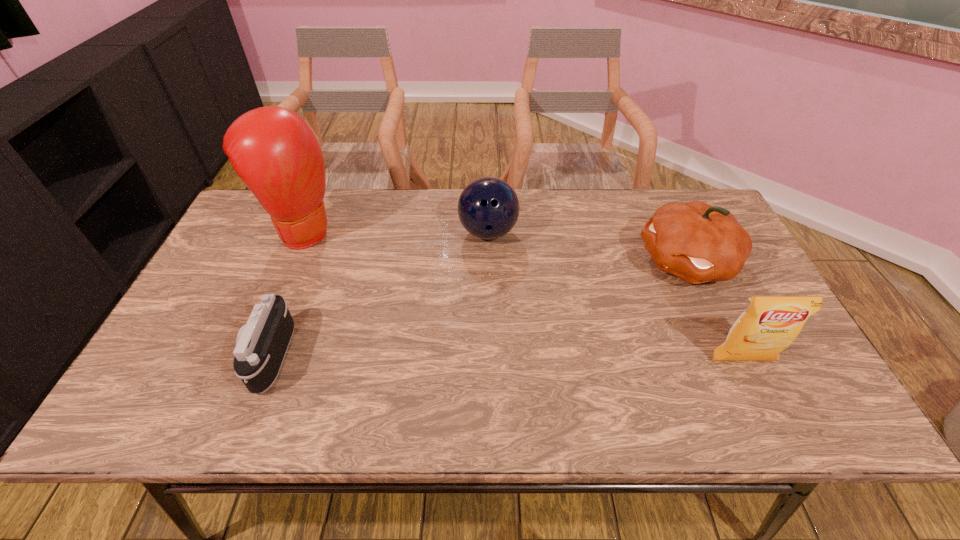
I want to click on unoccupied position between the crisp (potato chip) and the tallest object, so click(523, 295).

Where is `vacant space that is in between the tallest object and the second shortest object`? The width and height of the screenshot is (960, 540). vacant space that is in between the tallest object and the second shortest object is located at coordinates (396, 231).

This screenshot has width=960, height=540. Find the location of `unoccupied area between the shortest object and the tallest object`. unoccupied area between the shortest object and the tallest object is located at coordinates (287, 293).

Identify which object is the nearest to the third object from left to right. Please provide its 2D coordinates. Your answer should be formatted as a tuple, i.e. [(x, y)], where the tuple contains the x and y coordinates of a point satisfying the conditions above.

[(698, 243)]

Identify which object is the closest to the crisp (potato chip). Please provide its 2D coordinates. Your answer should be formatted as a tuple, i.e. [(x, y)], where the tuple contains the x and y coordinates of a point satisfying the conditions above.

[(698, 243)]

Where is `blank space that satisfies the following two spatial constraints: 1. on the front side of the pumpkin; 2. on the left side of the third object from right to left`? This screenshot has height=540, width=960. blank space that satisfies the following two spatial constraints: 1. on the front side of the pumpkin; 2. on the left side of the third object from right to left is located at coordinates (489, 262).